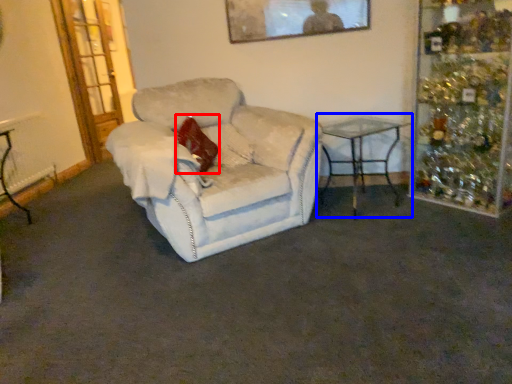
Question: Which point is closer to the camera, pillow (highlighted by a red box) or table (highlighted by a blue box)?

Choices:
 (A) pillow
 (B) table

Answer: (B)